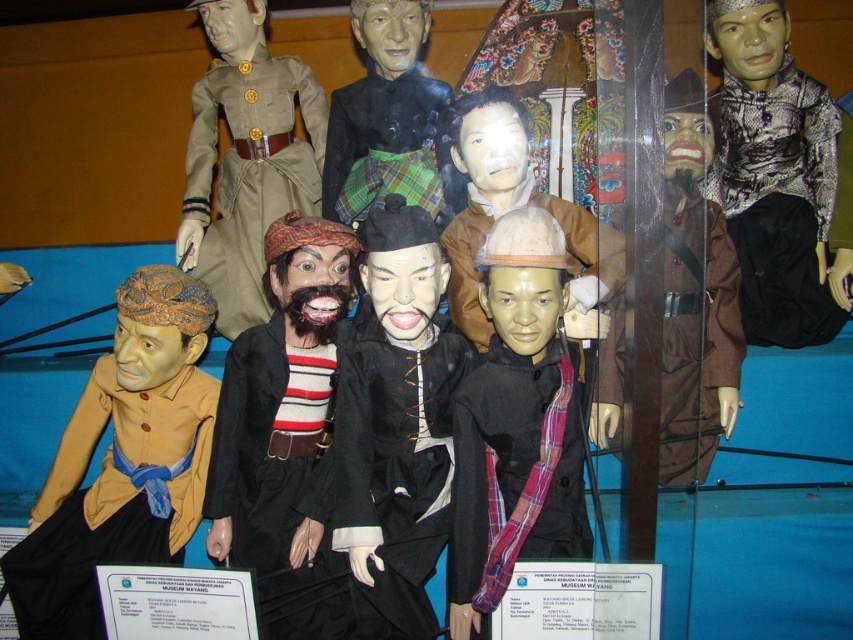
Question: Is black satin robe at center wider than snake skin shirt at right?

Choices:
 (A) no
 (B) yes

Answer: (A)

Question: Estimate the real-world distances between objects in this image. Which object is closer to the matte brown head at center?

Choices:
 (A) matte brown uniform at upper left
 (B) plaid fabric scarf at center
 (C) striped wool sweater at center
 (D) black satin robe at center

Answer: (B)

Question: Is matte brown uniform at upper left above matte black mask at center?

Choices:
 (A) yes
 (B) no

Answer: (B)

Question: Can you confirm if brown matte jacket at lower left is bigger than matte black mask at center?

Choices:
 (A) yes
 (B) no

Answer: (A)

Question: Among these points, which one is farthest from the camera?

Choices:
 (A) (361, 412)
 (B) (799, 275)

Answer: (B)

Question: Among these points, which one is farthest from the camera?

Choices:
 (A) (467, 308)
 (B) (613, 372)
 (C) (189, 145)

Answer: (C)